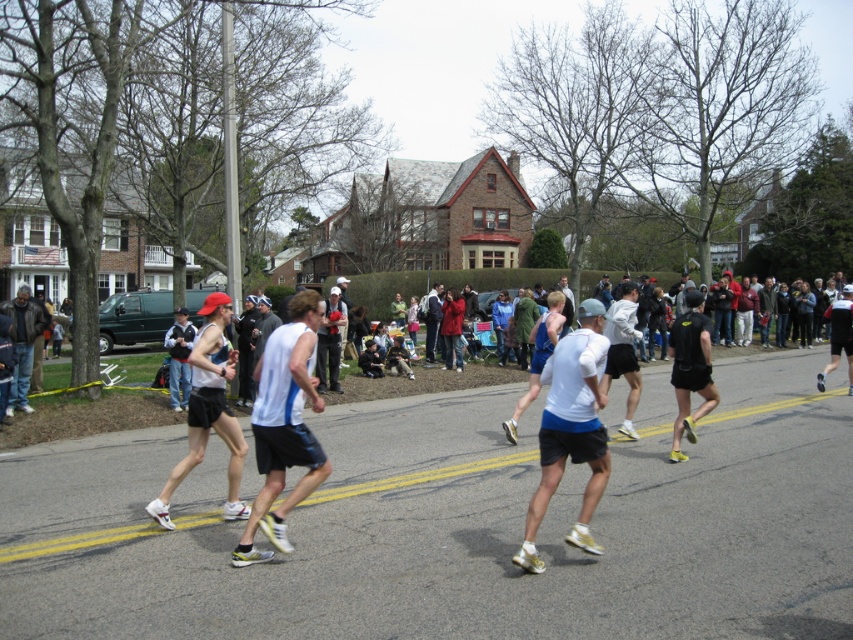
Question: Which point is farther to the camera?

Choices:
 (A) (285, 388)
 (B) (184, 360)

Answer: (B)

Question: Is white matte tank top at center further to camera compared to matte white tank top at center?

Choices:
 (A) yes
 (B) no

Answer: (B)

Question: Which object is positioned farthest from the white matte tank top at center?

Choices:
 (A) matte white tank top at center
 (B) white matte shirt at center

Answer: (A)

Question: Can you confirm if white matte tank top at center is smaller than matte white tank top at center?

Choices:
 (A) no
 (B) yes

Answer: (A)

Question: Does white matte tank top at center appear over white matte shirt at center?

Choices:
 (A) yes
 (B) no

Answer: (A)

Question: Which point appears closest to the camera in this image?

Choices:
 (A) (567, 372)
 (B) (189, 324)
 (C) (317, 477)
 (D) (26, 381)

Answer: (A)